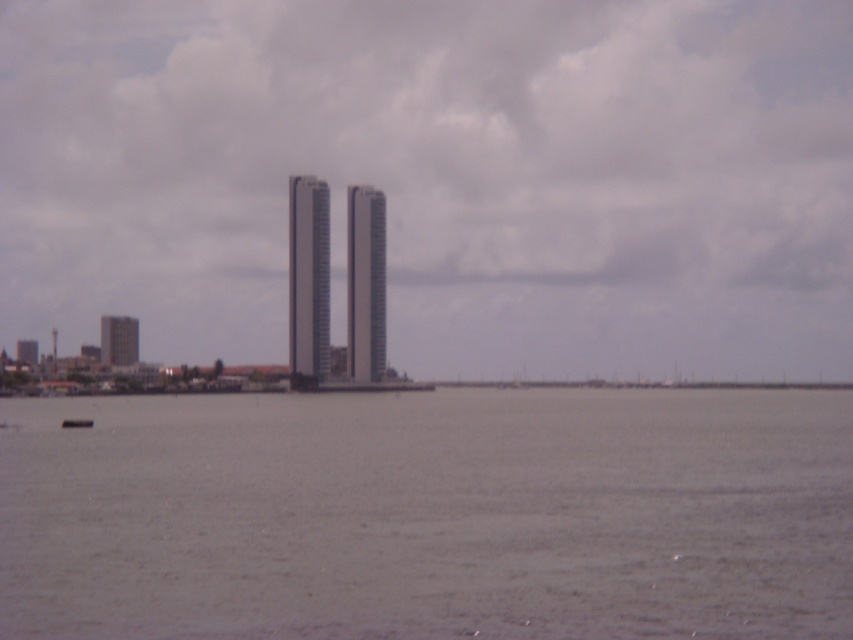
Question: Is matte glass skyscrapers at center positioned behind gray matte water at center?

Choices:
 (A) no
 (B) yes

Answer: (B)

Question: Does smooth glass tower at center come in front of gray concrete tower at left?

Choices:
 (A) yes
 (B) no

Answer: (A)

Question: Which point is farther to the camera?

Choices:
 (A) (88, 417)
 (B) (376, 310)

Answer: (B)

Question: Among these points, which one is farthest from the camera?

Choices:
 (A) (451, 474)
 (B) (368, 301)

Answer: (B)

Question: Which point is closer to the camera?

Choices:
 (A) black plastic boat at lower left
 (B) smooth glass tower at center

Answer: (A)

Question: Can you confirm if gray matte water at center is wider than white glass tower at center?

Choices:
 (A) no
 (B) yes

Answer: (B)